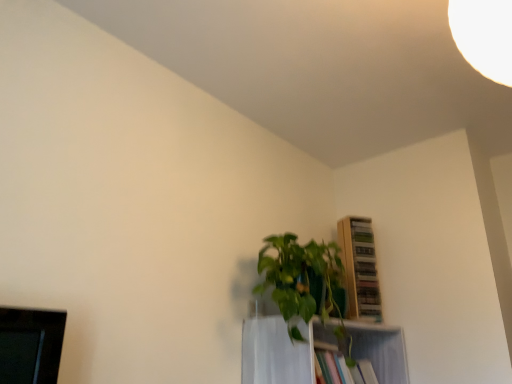
What do you see at coordinates (281, 350) in the screenshot? This screenshot has height=384, width=512. I see `white glossy shelf at center, which is counted as the second shelf, starting from the top` at bounding box center [281, 350].

What are the coordinates of `green leafy plant at center` in the screenshot? It's located at (305, 284).

You are a GUI agent. You are given a task and a screenshot of the screen. Output one action in this format:
    pyautogui.click(x=<x>, y=<y>)
    Task: Click on the wooden shelf at upper right, the 2th shelf ordered from the bottom
    
    Given the screenshot: What is the action you would take?
    pyautogui.click(x=360, y=268)

Considering the sizes of objects green leafy plant at center and wooden shelf at upper right, which ranks as the 1th shelf in top-to-bottom order, in the image provided, who is shorter, green leafy plant at center or wooden shelf at upper right, which ranks as the 1th shelf in top-to-bottom order,?

Standing shorter between the two is green leafy plant at center.

In order to click on houseplant that appears in front of the wooden shelf at upper right, the 2th shelf ordered from the bottom in this screenshot , I will do `click(305, 284)`.

Which of these two, green leafy plant at center or wooden shelf at upper right, which ranks as the 1th shelf in top-to-bottom order, is bigger?

green leafy plant at center.

Is green leafy plant at center located outside wooden shelf at upper right, which ranks as the 1th shelf in top-to-bottom order?

That's correct, green leafy plant at center is outside of wooden shelf at upper right, which ranks as the 1th shelf in top-to-bottom order.

Find the location of a particular element. the 2nd shelf below when counting from the green leafy plant at center (from the image's perspective) is located at coordinates 281,350.

Can you confirm if white glossy shelf at center, placed as the first shelf when sorted from bottom to top, is thinner than green leafy plant at center?

Yes.

How different are the orientations of white glossy shelf at center, which is counted as the second shelf, starting from the top, and green leafy plant at center in degrees?

6.66e-05 degrees.

From the image's perspective, which one is positioned lower, wooden shelf at upper right, which ranks as the 1th shelf in top-to-bottom order, or green leafy plant at center?

From the image's view, wooden shelf at upper right, which ranks as the 1th shelf in top-to-bottom order, is below.

Is wooden shelf at upper right, which ranks as the 1th shelf in top-to-bottom order, directly adjacent to green leafy plant at center?

No, wooden shelf at upper right, which ranks as the 1th shelf in top-to-bottom order, is not making contact with green leafy plant at center.

Could you measure the distance between wooden shelf at upper right, the 2th shelf ordered from the bottom, and green leafy plant at center?

wooden shelf at upper right, the 2th shelf ordered from the bottom, is 14.34 inches from green leafy plant at center.

Is wooden shelf at upper right, the 2th shelf ordered from the bottom, positioned in front of green leafy plant at center?

No, it is not.

In terms of width, does wooden shelf at upper right, which ranks as the 1th shelf in top-to-bottom order, look wider or thinner when compared to white glossy shelf at center, which is counted as the second shelf, starting from the top?

wooden shelf at upper right, which ranks as the 1th shelf in top-to-bottom order, is thinner than white glossy shelf at center, which is counted as the second shelf, starting from the top.

Which object is closer to the camera, wooden shelf at upper right, which ranks as the 1th shelf in top-to-bottom order, or white glossy shelf at center, placed as the first shelf when sorted from bottom to top?

white glossy shelf at center, placed as the first shelf when sorted from bottom to top.

In the image, there is a wooden shelf at upper right, which ranks as the 1th shelf in top-to-bottom order. Where is `shelf below it (from a real-world perspective)`? shelf below it (from a real-world perspective) is located at coordinates (281, 350).

Image resolution: width=512 pixels, height=384 pixels. Find the location of `shelf on the left of wooden shelf at upper right, the 2th shelf ordered from the bottom`. shelf on the left of wooden shelf at upper right, the 2th shelf ordered from the bottom is located at coordinates (281, 350).

Between white glossy shelf at center, which is counted as the second shelf, starting from the top, and wooden shelf at upper right, the 2th shelf ordered from the bottom, which one has larger size?

With larger size is white glossy shelf at center, which is counted as the second shelf, starting from the top.

From the image's perspective, is white glossy shelf at center, which is counted as the second shelf, starting from the top, located above or below wooden shelf at upper right, which ranks as the 1th shelf in top-to-bottom order?

white glossy shelf at center, which is counted as the second shelf, starting from the top, is below wooden shelf at upper right, which ranks as the 1th shelf in top-to-bottom order.

Considering the relative positions of green leafy plant at center and white glossy shelf at center, which is counted as the second shelf, starting from the top, in the image provided, is green leafy plant at center to the right of white glossy shelf at center, which is counted as the second shelf, starting from the top, from the viewer's perspective?

No.

From a real-world perspective, is green leafy plant at center physically located above or below white glossy shelf at center, placed as the first shelf when sorted from bottom to top?

Clearly, from a real-world perspective, green leafy plant at center is above white glossy shelf at center, placed as the first shelf when sorted from bottom to top.

From the picture: Does green leafy plant at center have a larger size compared to white glossy shelf at center, which is counted as the second shelf, starting from the top?

Indeed, green leafy plant at center has a larger size compared to white glossy shelf at center, which is counted as the second shelf, starting from the top.

Considering the positions of objects green leafy plant at center and white glossy shelf at center, which is counted as the second shelf, starting from the top, in the image provided, who is behind, green leafy plant at center or white glossy shelf at center, which is counted as the second shelf, starting from the top,?

white glossy shelf at center, which is counted as the second shelf, starting from the top, is behind.

Find the location of `houseplant that is under the wooden shelf at upper right, the 2th shelf ordered from the bottom (from a real-world perspective)`. houseplant that is under the wooden shelf at upper right, the 2th shelf ordered from the bottom (from a real-world perspective) is located at coordinates (305, 284).

Find the location of a particular element. This screenshot has height=384, width=512. houseplant in front of the white glossy shelf at center, placed as the first shelf when sorted from bottom to top is located at coordinates (305, 284).

When comparing their distances from green leafy plant at center, does white glossy shelf at center, which is counted as the second shelf, starting from the top, or wooden shelf at upper right, which ranks as the 1th shelf in top-to-bottom order, seem closer?

Among the two, white glossy shelf at center, which is counted as the second shelf, starting from the top, is located nearer to green leafy plant at center.

Estimate the real-world distances between objects in this image. Which object is further from wooden shelf at upper right, the 2th shelf ordered from the bottom, white glossy shelf at center, which is counted as the second shelf, starting from the top, or green leafy plant at center?

Among the two, green leafy plant at center is located further to wooden shelf at upper right, the 2th shelf ordered from the bottom.

Looking at the image, which one is located further to white glossy shelf at center, placed as the first shelf when sorted from bottom to top, wooden shelf at upper right, the 2th shelf ordered from the bottom, or green leafy plant at center?

Based on the image, wooden shelf at upper right, the 2th shelf ordered from the bottom, appears to be further to white glossy shelf at center, placed as the first shelf when sorted from bottom to top.

Considering their positions, is wooden shelf at upper right, the 2th shelf ordered from the bottom, positioned closer to green leafy plant at center than white glossy shelf at center, placed as the first shelf when sorted from bottom to top?

white glossy shelf at center, placed as the first shelf when sorted from bottom to top.

Which object lies nearer to the anchor point white glossy shelf at center, which is counted as the second shelf, starting from the top, green leafy plant at center or wooden shelf at upper right, the 2th shelf ordered from the bottom?

The object closer to white glossy shelf at center, which is counted as the second shelf, starting from the top, is green leafy plant at center.

Considering their positions, is green leafy plant at center positioned further to wooden shelf at upper right, which ranks as the 1th shelf in top-to-bottom order, than white glossy shelf at center, placed as the first shelf when sorted from bottom to top?

green leafy plant at center.

Find the location of a particular element. shelf between green leafy plant at center and wooden shelf at upper right, the 2th shelf ordered from the bottom, along the z-axis is located at coordinates (281, 350).